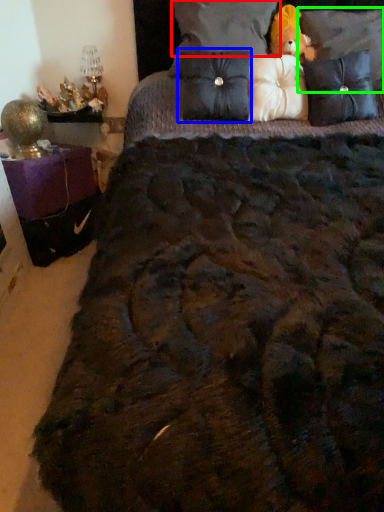
Question: Which is farther away from pillow (highlighted by a red box)? pillow (highlighted by a blue box) or pillow (highlighted by a green box)?

Choices:
 (A) pillow
 (B) pillow

Answer: (B)